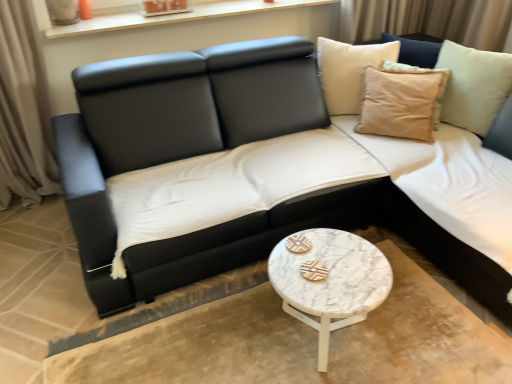
Question: From a real-world perspective, does black leather couch at center stand above white wood window sill at upper center?

Choices:
 (A) yes
 (B) no

Answer: (B)

Question: Does black leather couch at center have a larger size compared to white wood window sill at upper center?

Choices:
 (A) yes
 (B) no

Answer: (A)

Question: Could you tell me if black leather couch at center is turned towards white wood window sill at upper center?

Choices:
 (A) yes
 (B) no

Answer: (B)

Question: Is black leather couch at center smaller than white wood window sill at upper center?

Choices:
 (A) yes
 (B) no

Answer: (B)

Question: Is the position of black leather couch at center less distant than that of white wood window sill at upper center?

Choices:
 (A) yes
 (B) no

Answer: (A)

Question: Is black leather couch at center outside of white wood window sill at upper center?

Choices:
 (A) no
 (B) yes

Answer: (B)

Question: Is beige cotton cushion at upper right at the right side of black leather couch at center?

Choices:
 (A) no
 (B) yes

Answer: (B)

Question: Can black leather couch at center be found inside beige cotton cushion at upper right?

Choices:
 (A) yes
 (B) no

Answer: (B)

Question: Does beige cotton cushion at upper right have a lesser width compared to black leather couch at center?

Choices:
 (A) no
 (B) yes

Answer: (B)

Question: Considering the relative positions of beige cotton cushion at upper right and black leather couch at center in the image provided, is beige cotton cushion at upper right behind black leather couch at center?

Choices:
 (A) yes
 (B) no

Answer: (A)

Question: Can you confirm if beige cotton cushion at upper right is bigger than black leather couch at center?

Choices:
 (A) no
 (B) yes

Answer: (A)

Question: Does beige cotton cushion at upper right have a lesser height compared to black leather couch at center?

Choices:
 (A) yes
 (B) no

Answer: (A)

Question: Considering the relative sizes of black leather couch at center and beige cotton cushion at upper right in the image provided, is black leather couch at center shorter than beige cotton cushion at upper right?

Choices:
 (A) yes
 (B) no

Answer: (B)